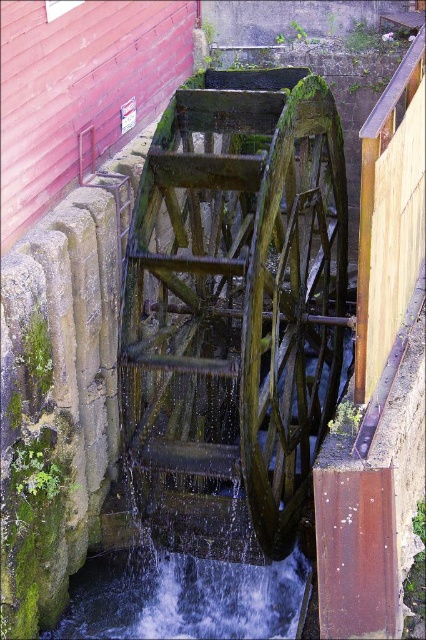
Which is more to the left, green mossy wood at center or green mossy wood wheel at center?

From the viewer's perspective, green mossy wood at center appears more on the left side.

Does green mossy wood at center have a smaller size compared to green mossy wood wheel at center?

Incorrect, green mossy wood at center is not smaller in size than green mossy wood wheel at center.

From the picture: Who is more forward, (304,248) or (290,304)?

Point (290,304)

Locate an element on the screen. green mossy wood at center is located at coordinates (235, 310).